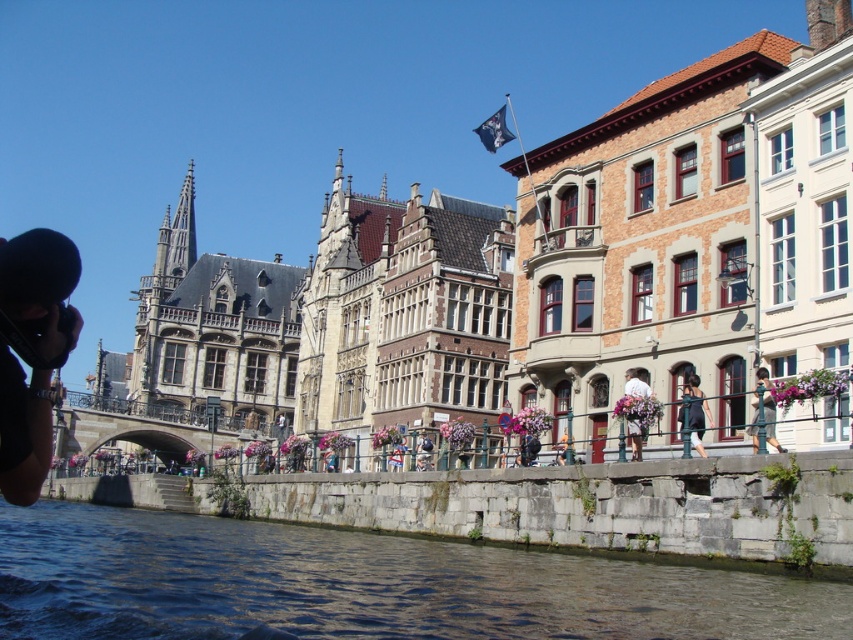
Question: Which object is closer to the camera taking this photo?

Choices:
 (A) green dress at lower right
 (B) orange fabric at center

Answer: (A)

Question: Estimate the real-world distances between objects in this image. Which object is farther from the orange fabric at center?

Choices:
 (A) black satin dress at center
 (B) clear water at lower center

Answer: (B)

Question: In this image, where is black satin dress at center located relative to orange fabric at center?

Choices:
 (A) right
 (B) left

Answer: (A)

Question: Is black satin dress at center to the right of green dress at lower right from the viewer's perspective?

Choices:
 (A) no
 (B) yes

Answer: (A)

Question: Which object is positioned closest to the black satin dress at center?

Choices:
 (A) clear water at lower center
 (B) orange fabric at center
 (C) floral bouquet at center

Answer: (C)

Question: Is green dress at lower right bigger than orange fabric at center?

Choices:
 (A) no
 (B) yes

Answer: (B)